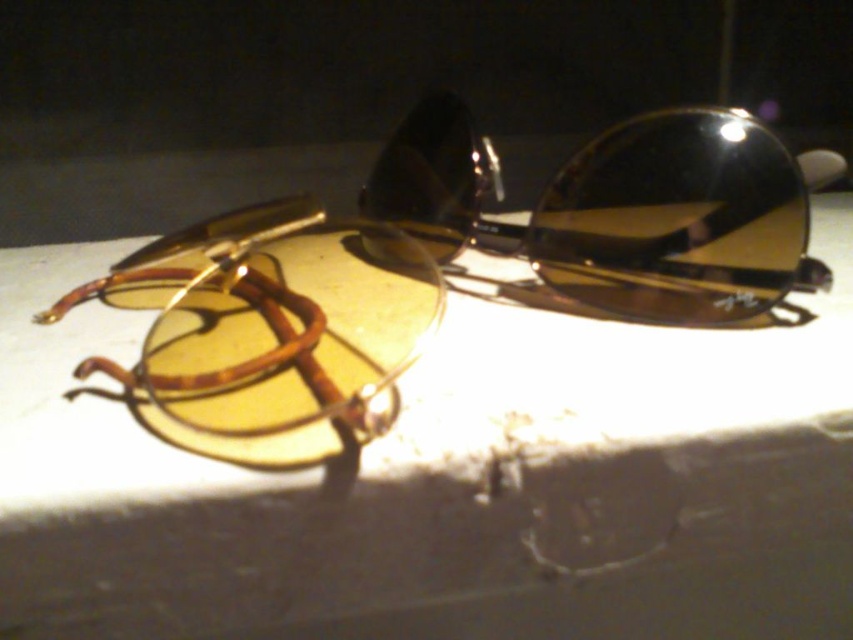
Question: Can you confirm if shiny black sunglasses at center is bigger than matte brown goggles at left?

Choices:
 (A) yes
 (B) no

Answer: (B)

Question: Which of the following is the farthest from the observer?

Choices:
 (A) (505, 275)
 (B) (579, 220)
 (C) (311, 301)

Answer: (A)

Question: Is shiny black sunglasses at center to the left of matte brown goggles at left from the viewer's perspective?

Choices:
 (A) no
 (B) yes

Answer: (A)

Question: Which is nearer to the matte brown goggles at left?

Choices:
 (A) matte yellow sunglasses at center
 (B) shiny black sunglasses at center

Answer: (A)

Question: Which point is closer to the camera?

Choices:
 (A) (692, 298)
 (B) (415, 440)

Answer: (B)

Question: Observing the image, what is the correct spatial positioning of shiny black sunglasses at center in reference to matte brown goggles at left?

Choices:
 (A) right
 (B) left

Answer: (A)